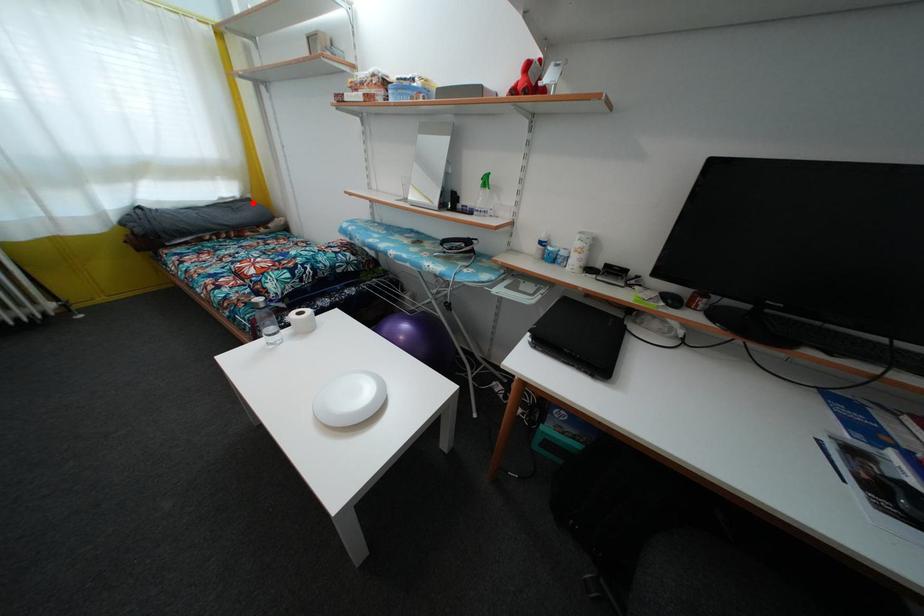
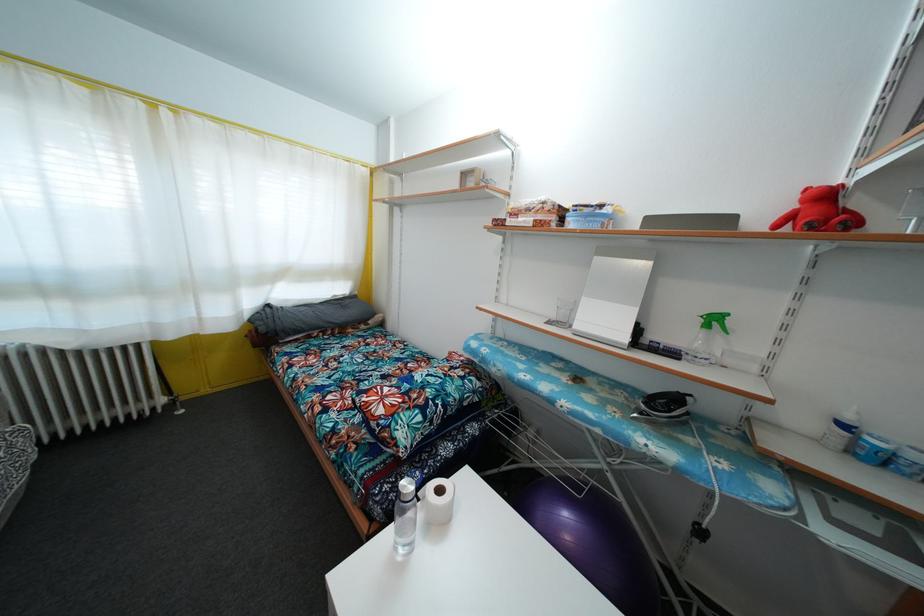
Question: I am providing you with two images of the same scene from different viewpoints. Image1 has a red point marked. In image2, the corresponding 3D location appears at what relative position? Reply with the corresponding letter.

Choices:
 (A) Closer
 (B) Farther

Answer: (B)